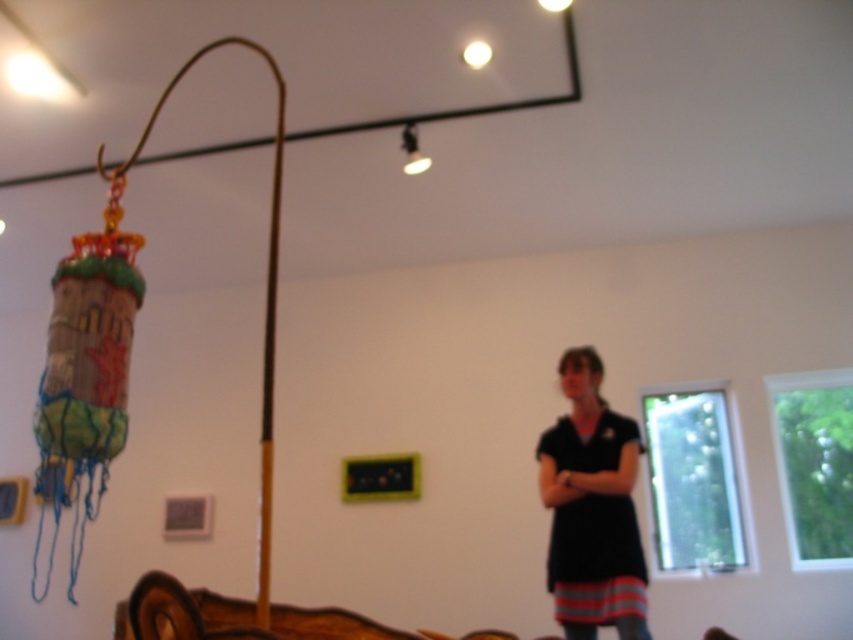
Question: Which object is farther from the camera taking this photo?

Choices:
 (A) brown wood pole at center
 (B) matte black lamp at upper center

Answer: (B)

Question: In this image, where is brown wooden bed at lower left located relative to matte black lamp at upper center?

Choices:
 (A) below
 (B) above

Answer: (A)

Question: Which point is farther from the camera taking this photo?

Choices:
 (A) (425, 157)
 (B) (277, 172)
 (C) (219, 612)

Answer: (A)

Question: Does black matte dress at right appear over brown wooden bed at lower left?

Choices:
 (A) no
 (B) yes

Answer: (A)

Question: Which point appears closest to the camera in this image?

Choices:
 (A) (404, 164)
 (B) (276, 68)
 (C) (283, 620)
 (D) (579, 518)

Answer: (C)

Question: Does black matte dress at right appear over brown wooden bed at lower left?

Choices:
 (A) yes
 (B) no

Answer: (B)